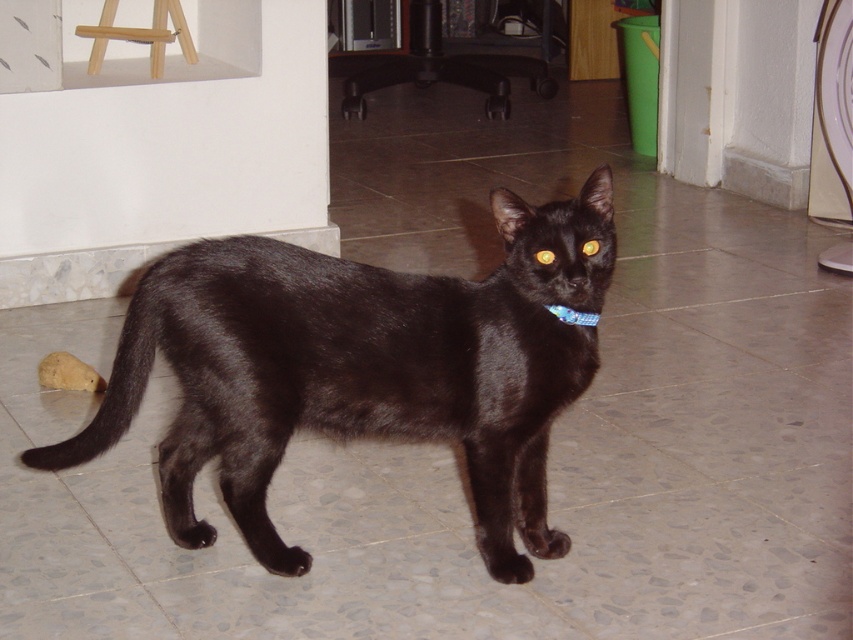
Is light brown wooden stool at upper left shorter than shiny black eye at center?

In fact, light brown wooden stool at upper left may be taller than shiny black eye at center.

In order to click on light brown wooden stool at upper left in this screenshot , I will do `click(140, 35)`.

Identify the location of light brown wooden stool at upper left. (140, 35).

Consider the image. Does blue fabric neckband at center appear under yellow shiny eye at center?

Yes.

Between point (583, 312) and point (538, 257), which one is positioned in front?

Positioned in front is point (538, 257).

Locate an element on the screen. This screenshot has width=853, height=640. blue fabric neckband at center is located at coordinates (573, 316).

Can you confirm if blue fabric neckband at center is taller than shiny black eye at center?

Yes, blue fabric neckband at center is taller than shiny black eye at center.

Between blue fabric neckband at center and shiny black eye at center, which one has more height?

Standing taller between the two is blue fabric neckband at center.

Locate an element on the screen. The image size is (853, 640). blue fabric neckband at center is located at coordinates (573, 316).